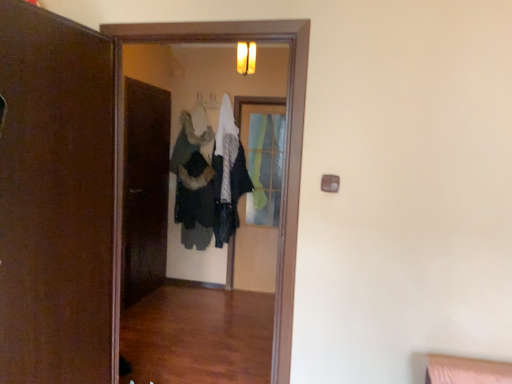
Question: From a real-world perspective, relative to brown matte door at left, is dark gray fabric coat at center vertically above or below?

Choices:
 (A) above
 (B) below

Answer: (A)

Question: Considering the positions of dark gray fabric coat at center and brown matte door at left in the image, is dark gray fabric coat at center taller or shorter than brown matte door at left?

Choices:
 (A) short
 (B) tall

Answer: (A)

Question: Which is nearer to the brown matte door at left?

Choices:
 (A) clear glass screen door at center, positioned as the 1th screen door in back-to-front order
 (B) wooden screen door at center, the first screen door viewed from the front
 (C) dark gray fabric coat at center

Answer: (B)

Question: Considering the real-world distances, which object is closest to the clear glass screen door at center, which appears as the second screen door when viewed from the front?

Choices:
 (A) wooden screen door at center, the first screen door viewed from the front
 (B) brown matte door at left
 (C) dark gray fabric coat at center

Answer: (C)